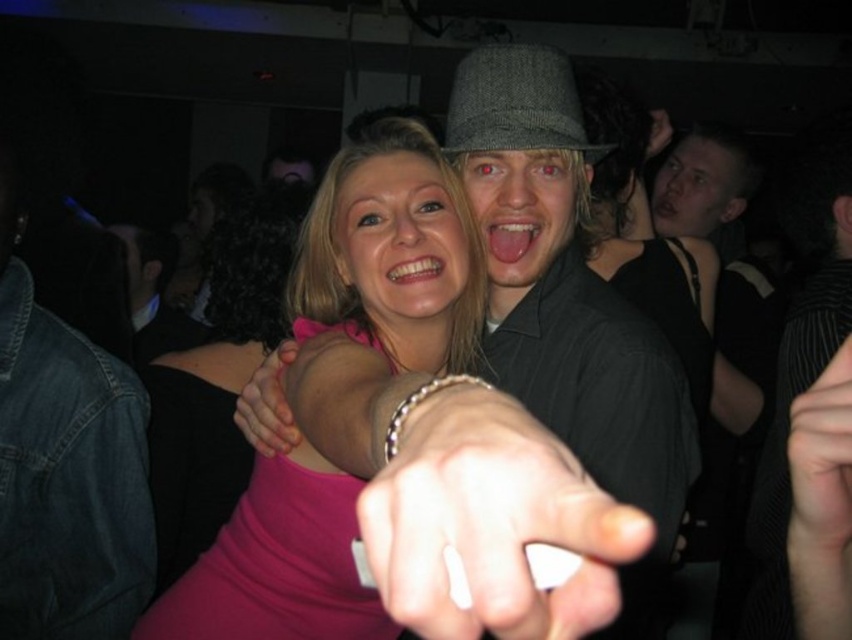
You are a photographer at a party and want to capture a clear photo of the pink matte dress at center. However, the dark gray textured shirt at center is blocking the view. Can you adjust your position to take the photo without the shirt blocking the dress?

The pink matte dress at center is in front of the dark gray textured shirt at center, so you can take the photo as it is already positioned in front and not blocked by the shirt.

Looking at this image, you are organizing a charity event and need to arrange two outfits on a mannequin stand. The mannequin has a limited width capacity of 30 cm. You have the pink matte dress at center and the dark gray textured shirt at center. According to the scene, which outfit would you choose to place on the mannequin to ensure it fits without exceeding the width limit?

The pink matte dress at center has a lesser width compared to the dark gray textured shirt at center, so the pink matte dress at center would fit better within the 30 cm width capacity of the mannequin stand.